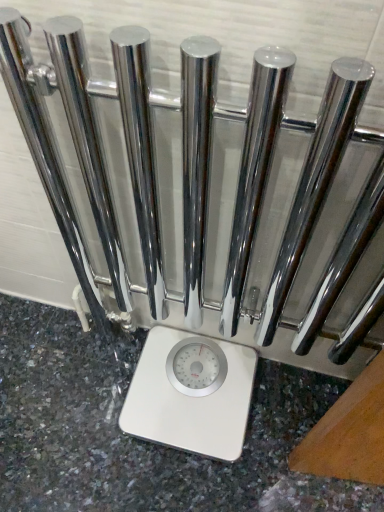
Locate an element on the screen. This screenshot has height=512, width=384. vacant point to the left of white glossy scale at center is located at coordinates (85, 426).